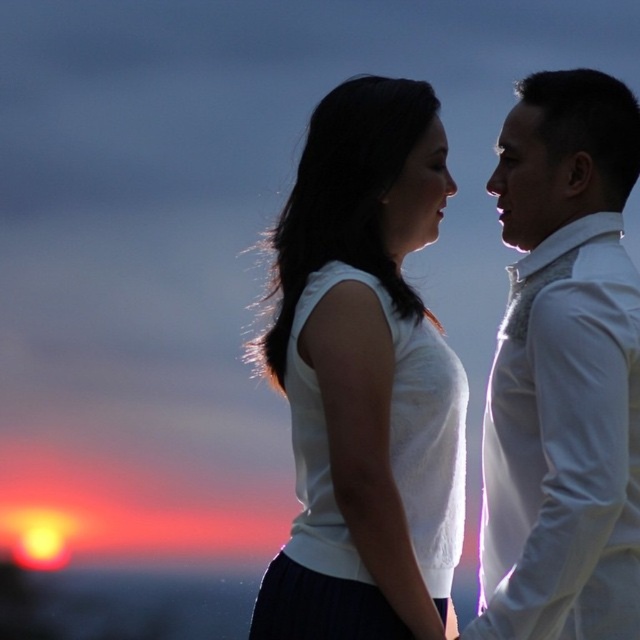
You are an artist trying to sketch this sunset scene. You notice the two white clothing items in the image. Which clothing item, the white matte tank top at center or the white textured shirt at right, is positioned lower in the image?

The white matte tank top at center is positioned lower in the image because it is located below the white textured shirt at right.

You are a photographer trying to capture the sunset scene. You notice two white clothing items in the frame. Which clothing item, the white matte tank top at center or the white textured shirt at right, is closer to the camera?

The white matte tank top at center is closer to the camera because the white textured shirt at right is positioned behind it.